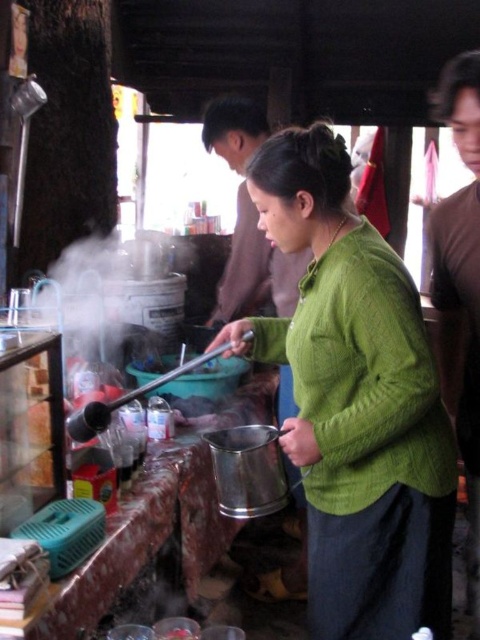
Does green knitted sweater at center have a lesser height compared to brown cotton shirt at upper right?

Indeed, green knitted sweater at center has a lesser height compared to brown cotton shirt at upper right.

Who is positioned more to the left, green knitted sweater at center or brown cotton shirt at upper right?

From the viewer's perspective, green knitted sweater at center appears more on the left side.

Describe the element at coordinates (356, 403) in the screenshot. This screenshot has height=640, width=480. I see `green knitted sweater at center` at that location.

The image size is (480, 640). Find the location of `green knitted sweater at center`. green knitted sweater at center is located at coordinates (356, 403).